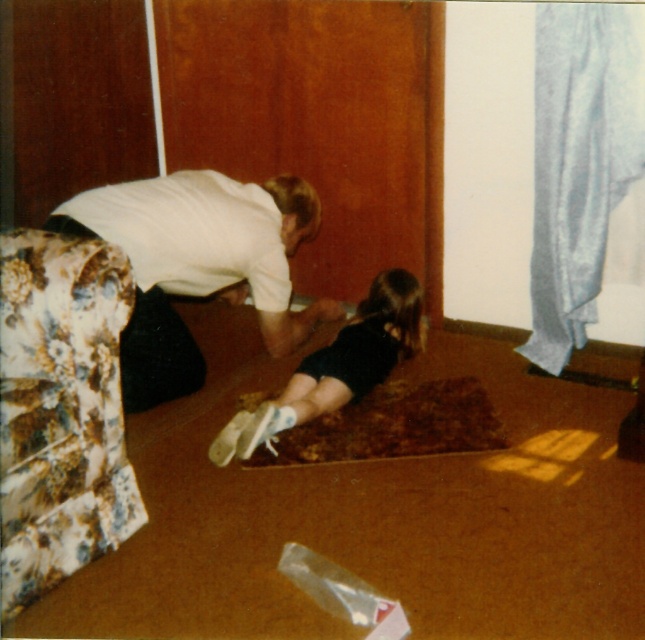
You are a photographer setting up a photo shoot in this room. You want to position two models wearing the white matte shirt at center and the black fabric dress at center so that they are exactly 24 inches apart. Based on the current distance between them, is the current distance sufficient or do they need to move closer or farther apart?

The current distance between the white matte shirt at center and the black fabric dress at center is 16.87 inches. Since 16.87 inches is less than 24 inches, the models need to move farther apart to achieve the desired distance.

You are standing in the room and want to move from the point at the center of the image to the floral sofa on the left. Which point, point at [277,330] or point at [384,346], is closer to the floral sofa on the left?

Point at [384,346] is closer to the floral sofa on the left because it is in front of point at [277,330], which is further away.